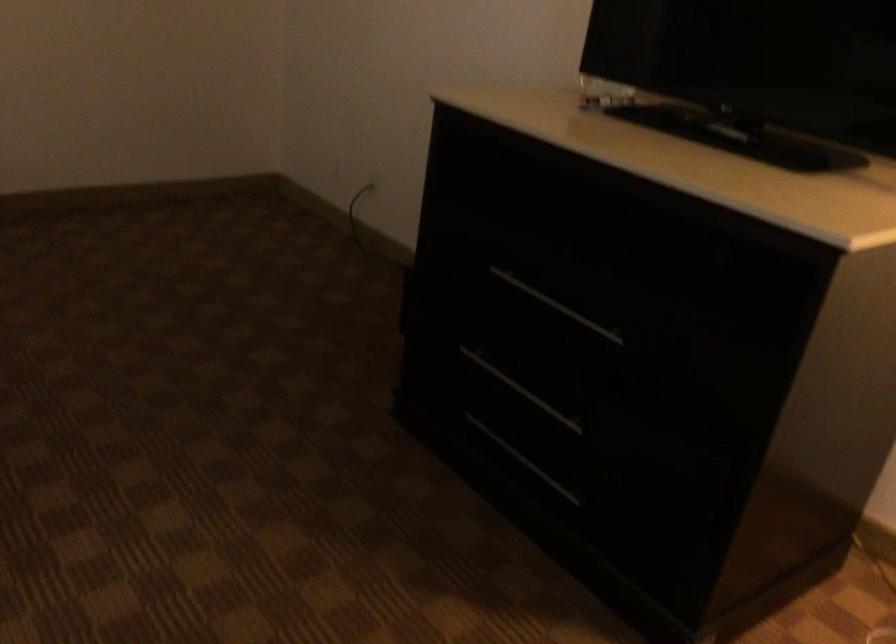
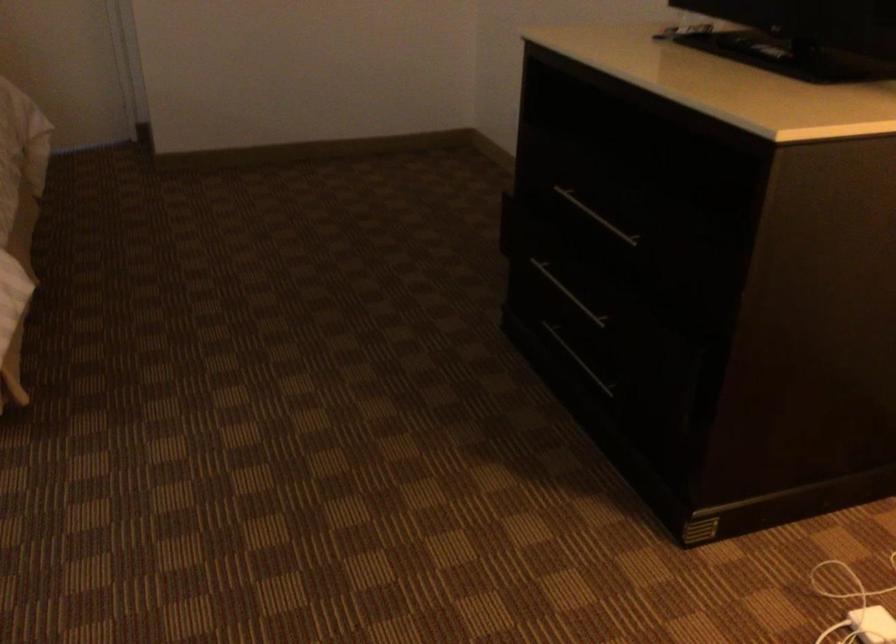
From the picture: The images are taken continuously from a first-person perspective. In which direction are you moving?

The cameraman walked toward right, backward.